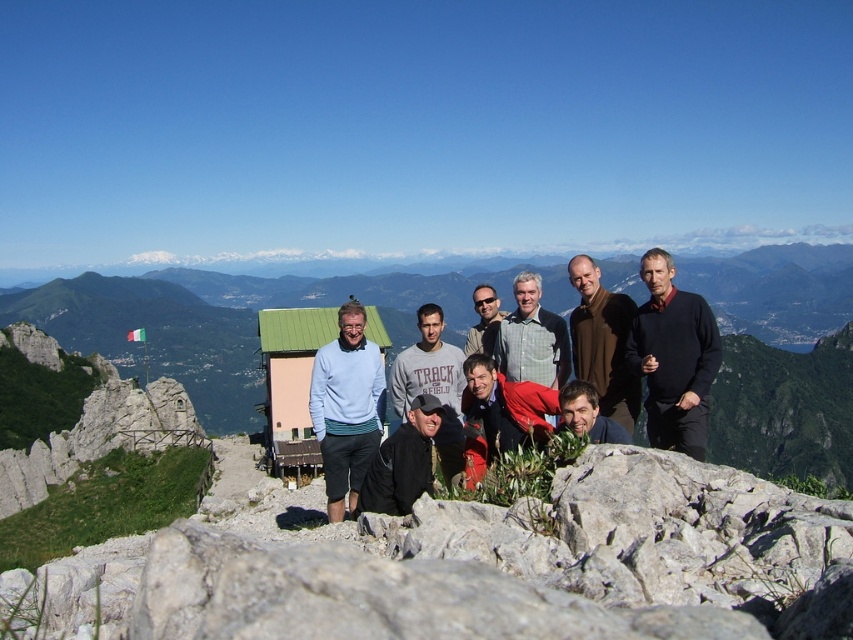
How distant is white rough stone at center from light brown sweater at center?

white rough stone at center is 69.52 feet away from light brown sweater at center.

Is point (531, 534) positioned behind point (541, 339)?

No.

Locate an element on the screen. The image size is (853, 640). white rough stone at center is located at coordinates (467, 563).

Who is higher up, brown wool sweater at center or black matte jacket at center?

Positioned higher is brown wool sweater at center.

Can you confirm if brown wool sweater at center is shorter than black matte jacket at center?

No.

Is point (614, 355) behind point (430, 436)?

Yes, point (614, 355) is behind point (430, 436).

I want to click on brown wool sweater at center, so click(x=602, y=342).

Between white rough stone at center and gray cotton sweatshirt at center, which one appears on the right side from the viewer's perspective?

Positioned to the right is gray cotton sweatshirt at center.

Does white rough stone at center have a smaller size compared to gray cotton sweatshirt at center?

Actually, white rough stone at center might be larger than gray cotton sweatshirt at center.

Find the location of a particular element. This screenshot has height=640, width=853. white rough stone at center is located at coordinates (467, 563).